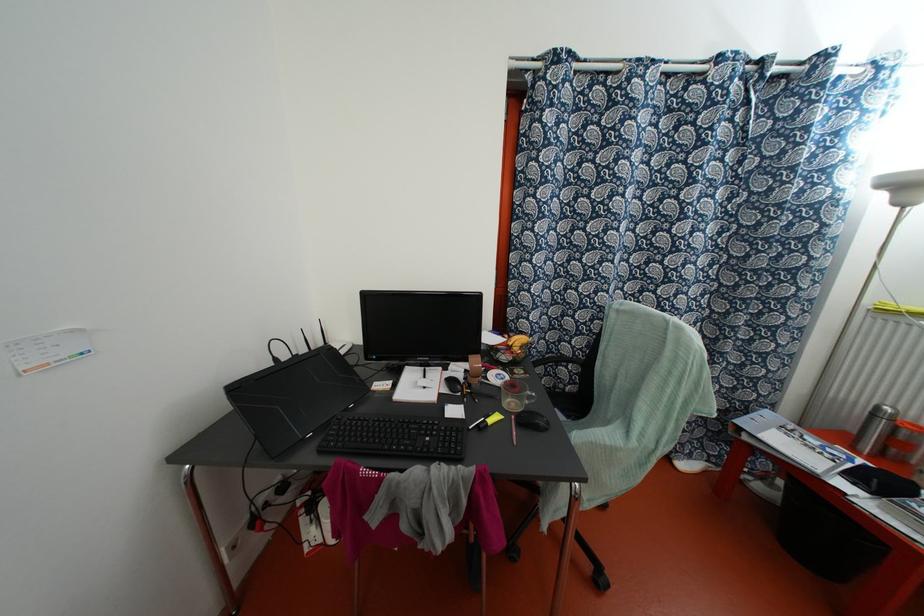
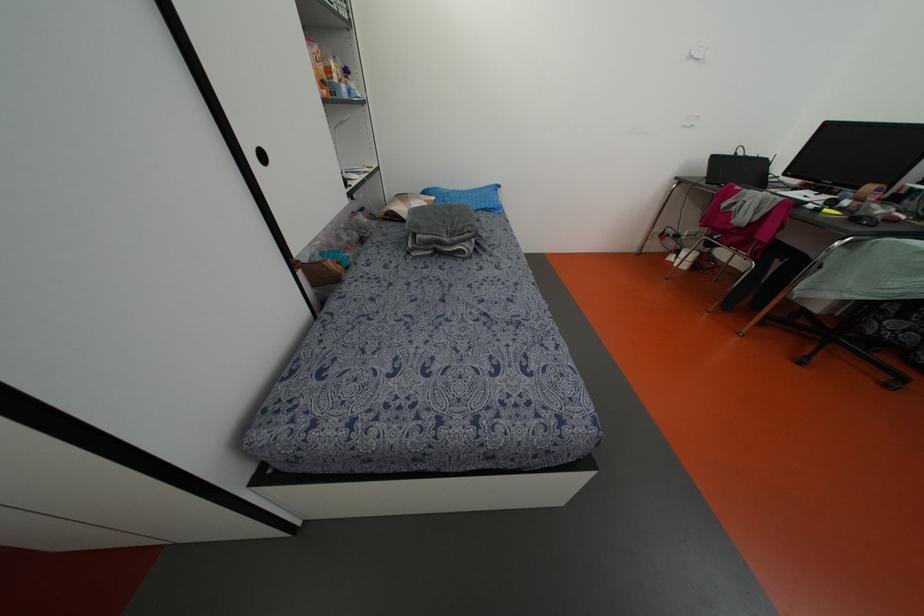
Where in the second image is the point corresponding to point (285, 355) from the first image?

(739, 153)